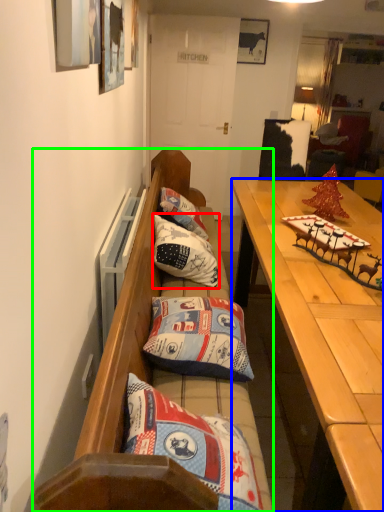
Question: Estimate the real-world distances between objects in this image. Which object is farther from pillow (highlighted by a red box), desk (highlighted by a blue box) or studio couch (highlighted by a green box)?

Choices:
 (A) desk
 (B) studio couch

Answer: (A)